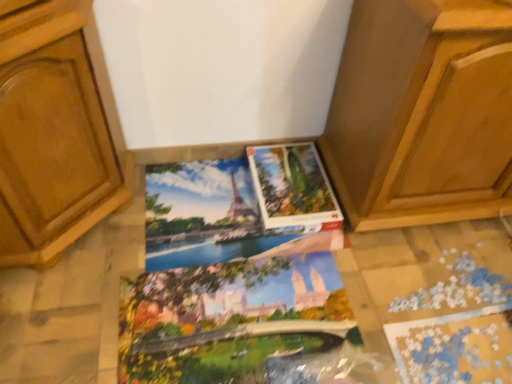
Identify the location of blank space above matte cardboard puzzle at center (from a real-world perspective). (294, 183).